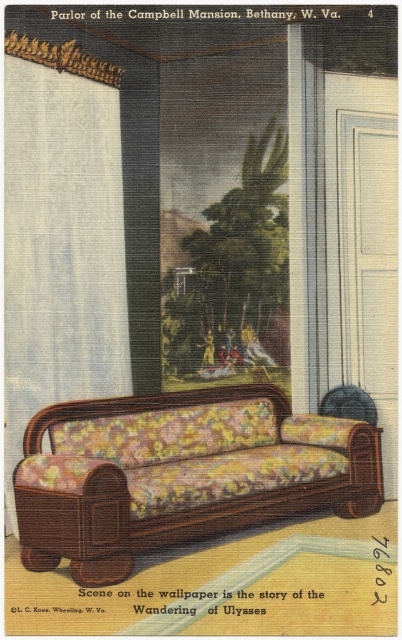
Between floral fabric couch at center and white textured curtain at left, which one is positioned higher?

Positioned higher is white textured curtain at left.

Which is more to the right, floral fabric couch at center or white textured curtain at left?

Positioned to the right is floral fabric couch at center.

Identify the location of floral fabric couch at center. This screenshot has height=640, width=402. (180, 474).